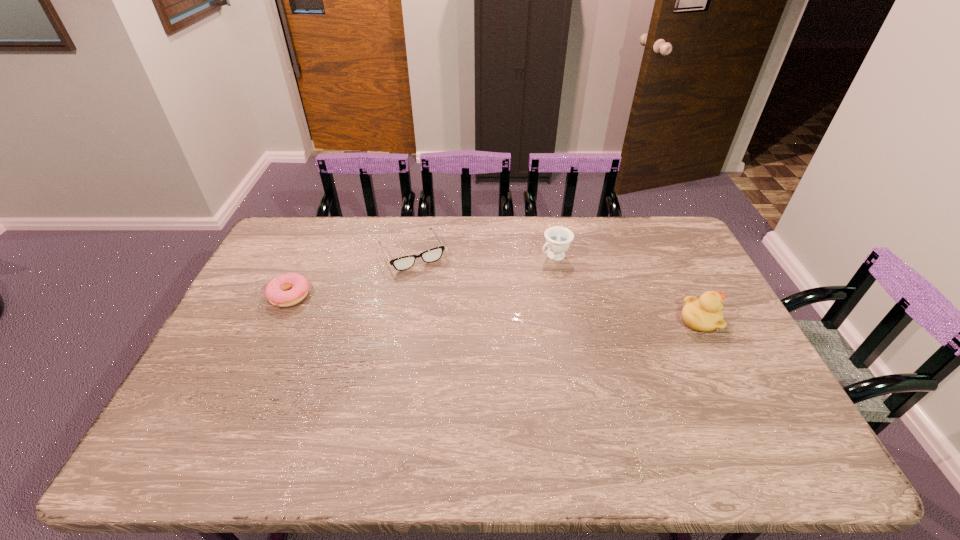
Identify the location of the leftmost object. pyautogui.click(x=275, y=291).

This screenshot has height=540, width=960. In order to click on duckling in this screenshot , I will do `click(705, 314)`.

Find the location of a particular element. The image size is (960, 540). spectacles is located at coordinates (402, 263).

Image resolution: width=960 pixels, height=540 pixels. I want to click on the second object from right to left, so click(x=558, y=239).

Image resolution: width=960 pixels, height=540 pixels. Identify the location of free space located 0.330m on the back of the leftmost object. (323, 223).

Identify the location of blank area located 0.250m on the front-facing side of the spectacles. This screenshot has height=540, width=960. (452, 321).

Locate an element on the screen. This screenshot has width=960, height=540. vacant region located on the front-facing side of the spectacles is located at coordinates (471, 355).

Find the location of `free space located 0.330m on the front-facing side of the spectacles`. free space located 0.330m on the front-facing side of the spectacles is located at coordinates (463, 340).

Locate an element on the screen. The width and height of the screenshot is (960, 540). blank space located 0.340m on the side of the teacup with the handle is located at coordinates click(470, 310).

What are the coordinates of `vacant space situated on the side of the teacup with the handle` in the screenshot? It's located at (530, 272).